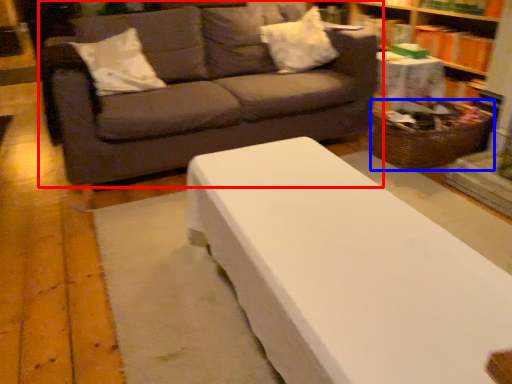
Question: Which point is closer to the camera, studio couch (highlighted by a red box) or basket (highlighted by a blue box)?

Choices:
 (A) studio couch
 (B) basket

Answer: (A)